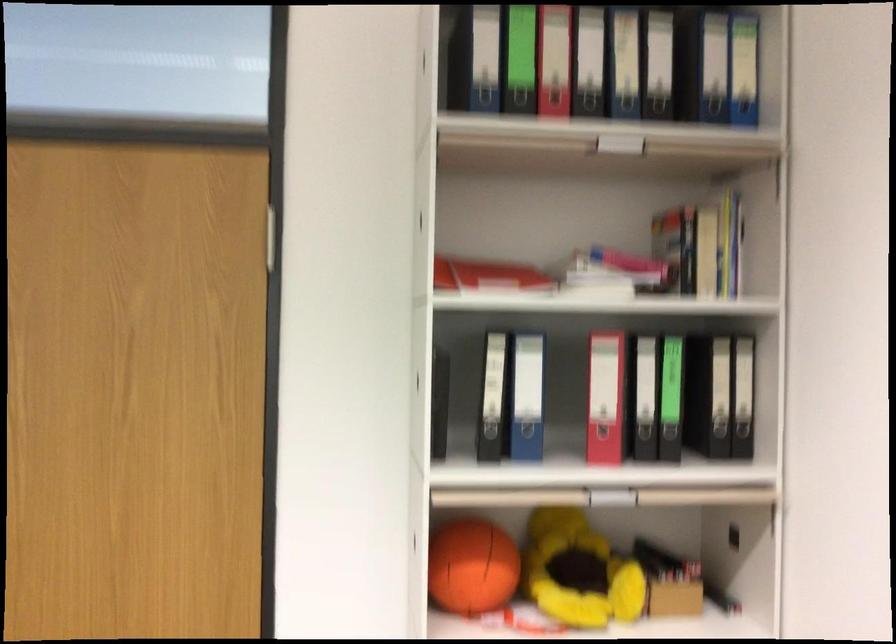
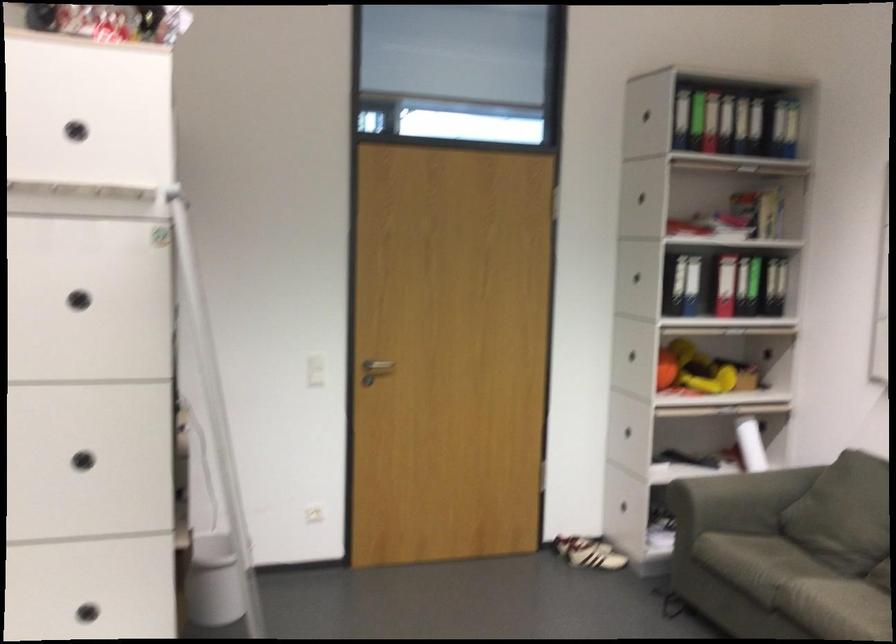
The point at (664, 91) is marked in the first image. Where is the corresponding point in the second image?

(764, 126)